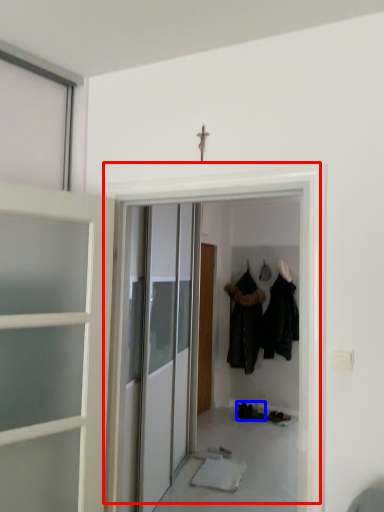
Question: Among these objects, which one is nearest to the camera, door (highlighted by a red box) or footwear (highlighted by a blue box)?

Choices:
 (A) door
 (B) footwear

Answer: (A)